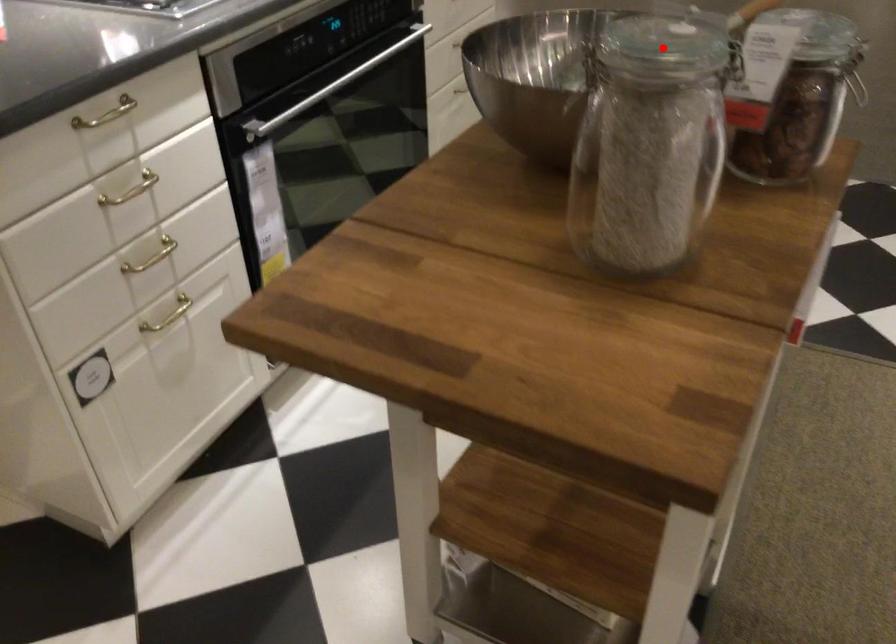
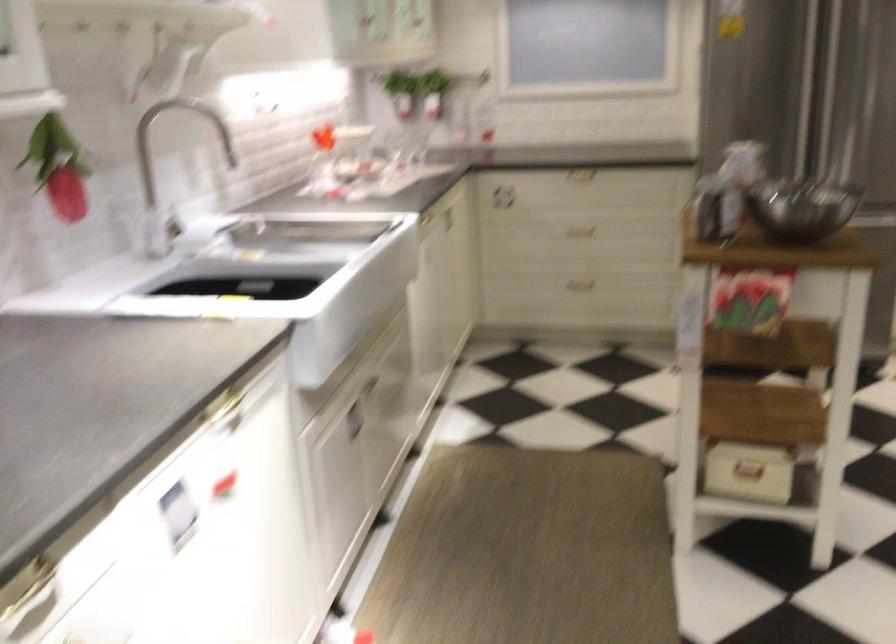
Question: I am providing you with two images of the same scene from different viewpoints. A red point is shown in image1. For the corresponding object point in image2, is it positioned nearer or farther from the camera?

Choices:
 (A) Nearer
 (B) Farther

Answer: (B)